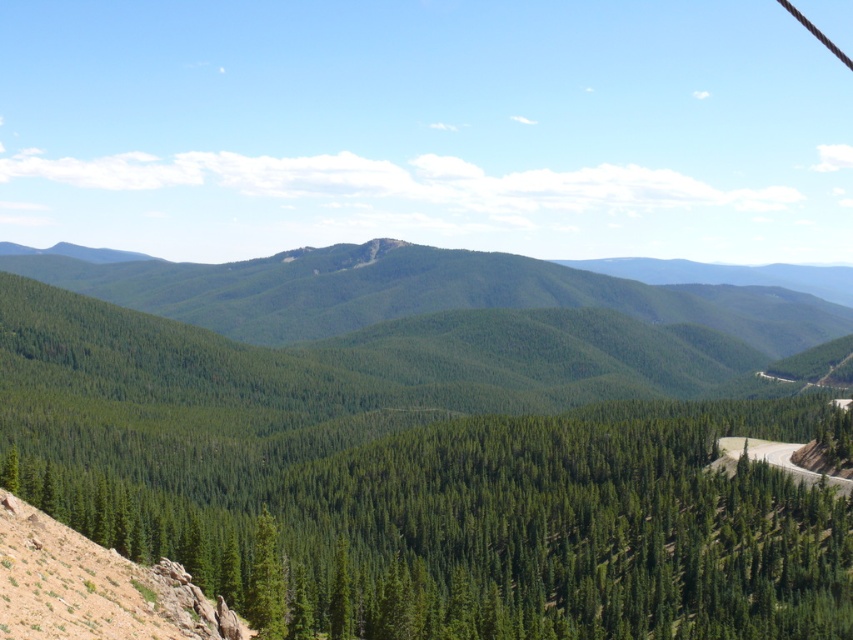
You are standing at the point labeled as point (503, 529) in the image. What do you see directly in front of you?

You see green textured trees at center directly in front of you.

You are a hiker standing at the starting point of the trail. You see the green textured trees at center and the green grassy mountain path at lower right. Which object is closer to you?

The green textured trees at center are closer to you since they are positioned in front of the green grassy mountain path at lower right.

You are a hiker planning to traverse the area shown in the image. You need to decide whether to take the green grassy mountain path at lower right or go through the green textured trees at center. Considering the size of the obstacles, which path would be easier to navigate?

The green textured trees at center is bigger than the green grassy mountain path at lower right. Therefore, the green grassy mountain path at lower right would be easier to navigate as it is smaller and less obstructive.